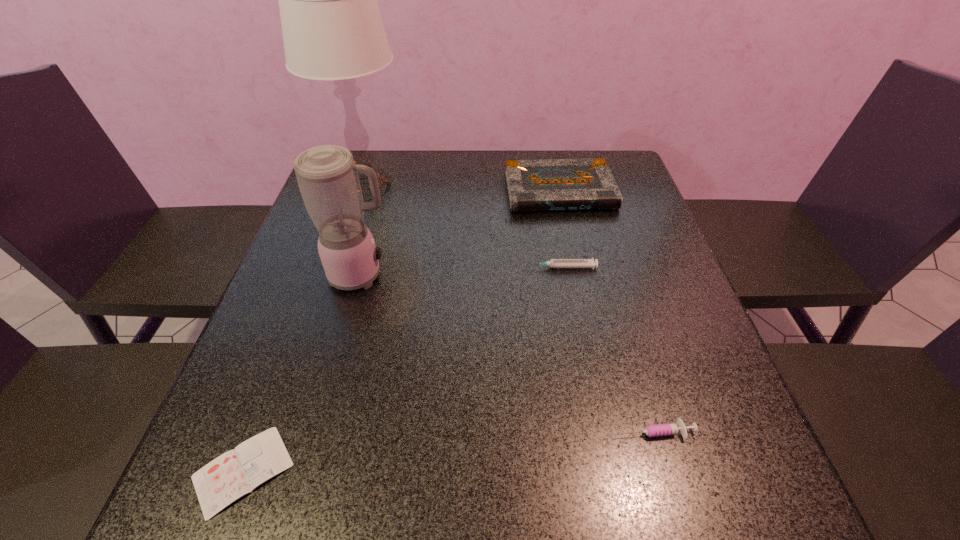
Where is `notebook at the right edge`? The height and width of the screenshot is (540, 960). notebook at the right edge is located at coordinates click(559, 184).

Where is `syringe that is at the right edge`? syringe that is at the right edge is located at coordinates (678, 428).

Where is `object that is at the far left corner`? The image size is (960, 540). object that is at the far left corner is located at coordinates (332, 29).

Identify the location of object at the near left corner. (237, 472).

Find the location of `object at the far right corner`. object at the far right corner is located at coordinates (559, 184).

Locate an element on the screen. Image resolution: width=960 pixels, height=540 pixels. free region at the far edge of the desktop is located at coordinates (485, 159).

Where is `blank space at the near edge`? This screenshot has width=960, height=540. blank space at the near edge is located at coordinates (595, 475).

The image size is (960, 540). I want to click on vacant space at the left edge of the desktop, so click(261, 327).

Find the location of `free space at the right edge of the desktop`. free space at the right edge of the desktop is located at coordinates (609, 215).

Find the location of a particular element. The image size is (960, 540). vacant space at the far right corner of the desktop is located at coordinates (584, 151).